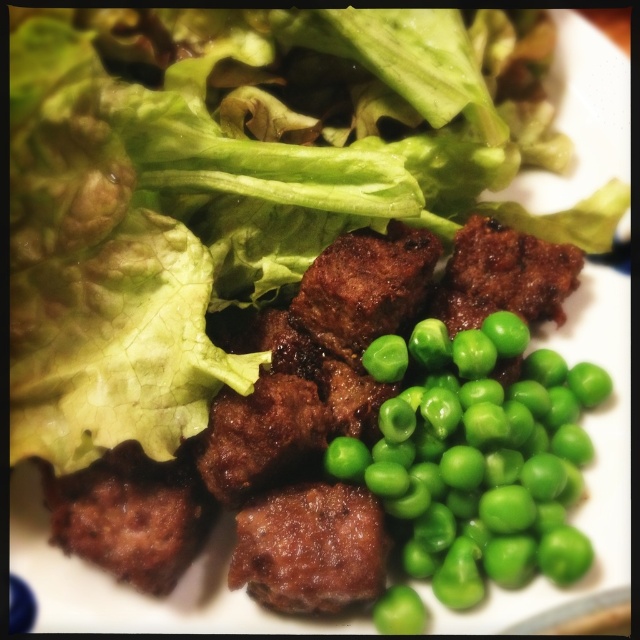
Question: Is green matte peas at center-right positioned behind brown crispy meat at center?

Choices:
 (A) yes
 (B) no

Answer: (A)

Question: Is green matte peas at center-right thinner than brown crispy meat at center?

Choices:
 (A) no
 (B) yes

Answer: (A)

Question: Which of the following is the closest to the observer?

Choices:
 (A) green matte peas at center-right
 (B) brown crispy meat at center

Answer: (B)

Question: Can you confirm if green matte peas at center-right is thinner than brown crispy meat at center?

Choices:
 (A) yes
 (B) no

Answer: (B)